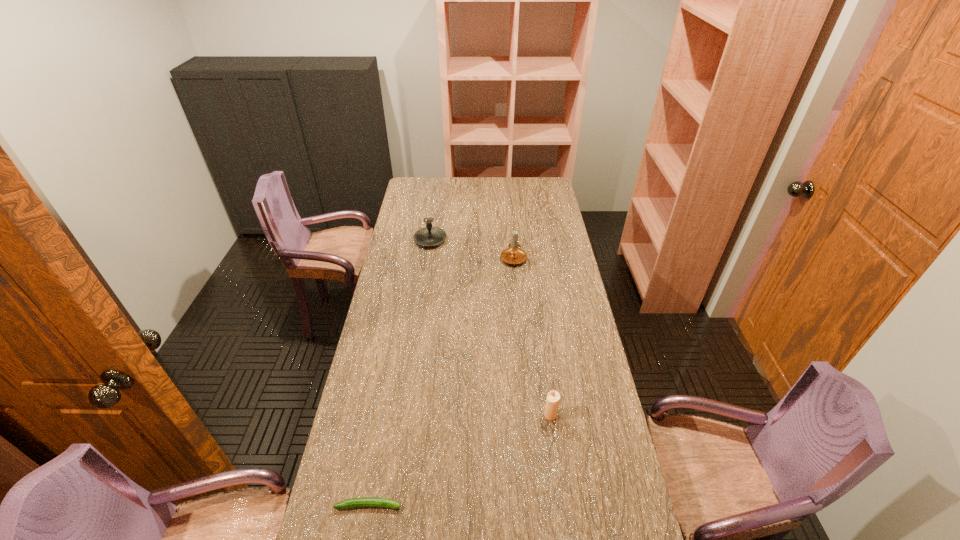
Identify the location of vacant point located between the second nearest object and the farthest object. (491, 328).

In order to click on free space between the leftmost candle and the second nearest object in this screenshot , I will do `click(491, 328)`.

At what (x,y) coordinates should I click in order to perform the action: click on free spot between the zucchini and the second nearest candle. Please return your answer as a coordinate pair (x, y). This screenshot has width=960, height=540. Looking at the image, I should click on (443, 382).

Locate an element on the screen. The height and width of the screenshot is (540, 960). empty space that is in between the second shortest object and the nearest object is located at coordinates (460, 460).

Identify the location of vacant area that lies between the second nearest candle and the third tallest object. The width and height of the screenshot is (960, 540). (534, 337).

This screenshot has width=960, height=540. What are the coordinates of `blank region between the farthest candle and the shortest object` in the screenshot? It's located at (399, 373).

The width and height of the screenshot is (960, 540). What are the coordinates of `free spot between the second nearest object and the nearest object` in the screenshot? It's located at (460, 460).

What are the coordinates of `free area in between the second farthest candle and the zucchini` in the screenshot? It's located at (443, 382).

The height and width of the screenshot is (540, 960). I want to click on object that is the second closest one to the second farthest object, so (x=553, y=398).

Find the location of a particular element. object that stands as the third closest to the second shortest object is located at coordinates (429, 236).